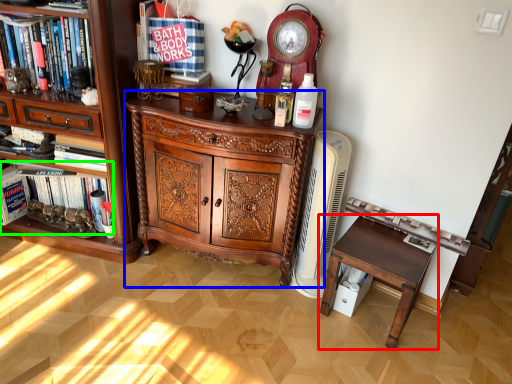
Question: Which is farther away from table (highlighted by a red box)? chest of drawers (highlighted by a blue box) or book (highlighted by a green box)?

Choices:
 (A) chest of drawers
 (B) book

Answer: (B)